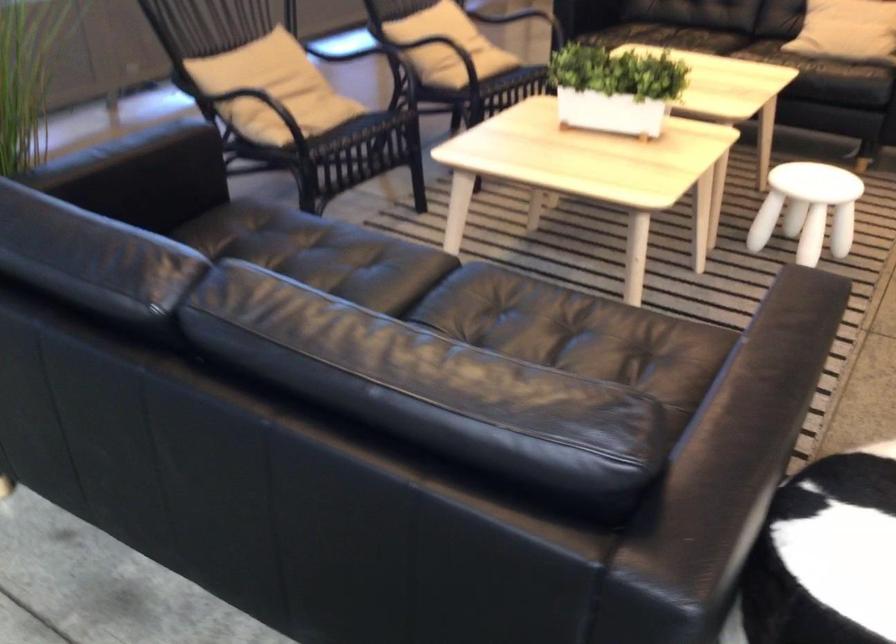
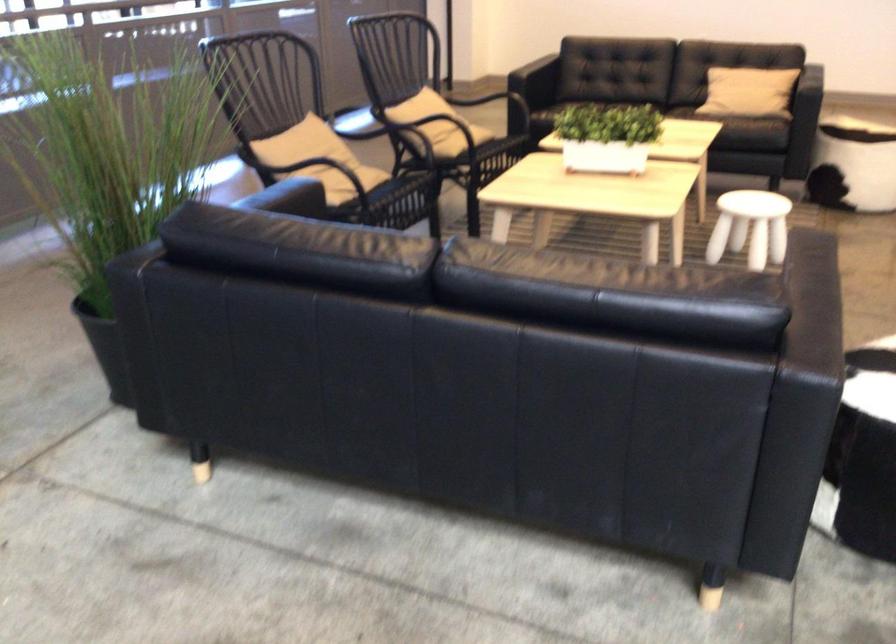
Locate, in the second image, the point that corresponds to point (321, 156) in the first image.

(382, 204)